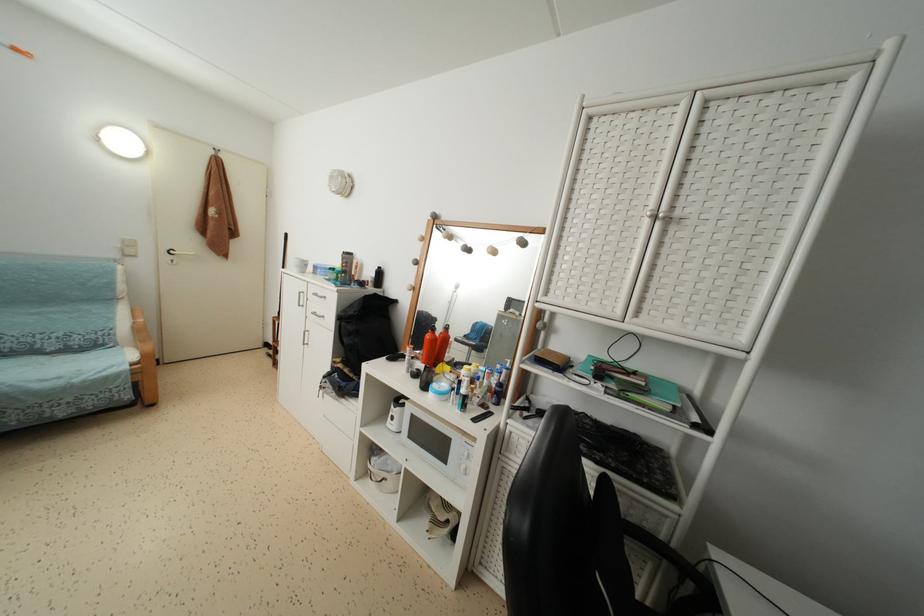
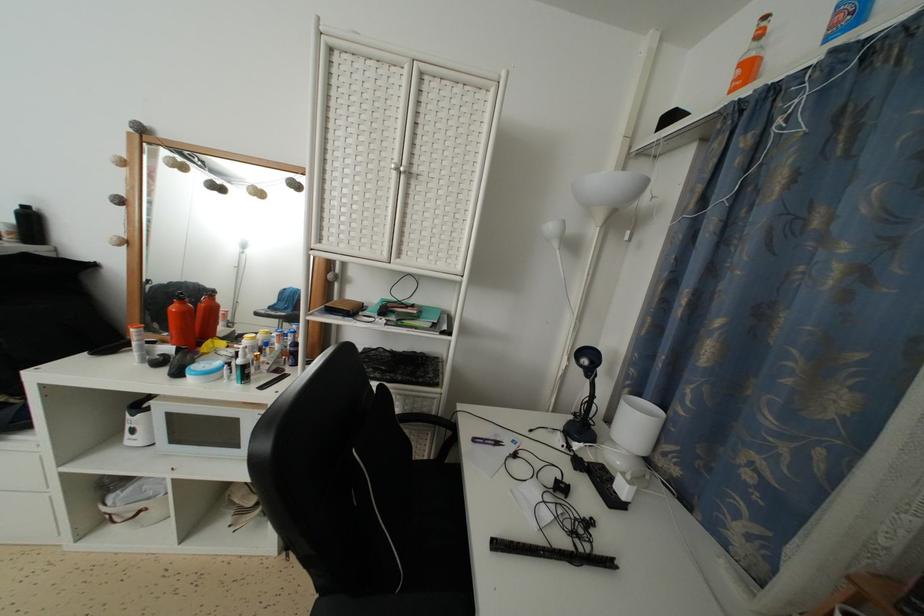
Locate, in the second image, the point that corresponds to [441,379] in the first image.

(209, 360)